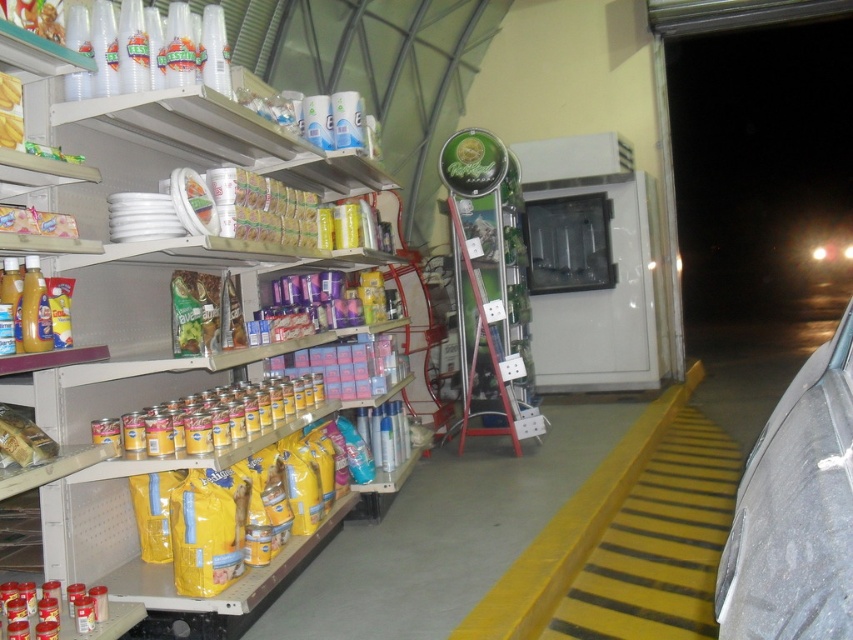
Question: Does yellow matte plastic bags at lower left have a lesser width compared to yellow rubber mat at lower right?

Choices:
 (A) yes
 (B) no

Answer: (A)

Question: Which object is farther from the camera taking this photo?

Choices:
 (A) yellow rubber mat at lower right
 (B) yellow matte plastic bags at lower left
 (C) matte gold foil at shelf left

Answer: (A)

Question: Which is nearer to the yellow rubber mat at lower right?

Choices:
 (A) matte gold foil at shelf left
 (B) yellow matte plastic bags at lower left

Answer: (B)

Question: Does yellow rubber mat at lower right have a larger size compared to matte gold foil at shelf left?

Choices:
 (A) yes
 (B) no

Answer: (A)

Question: Which point is farther to the camera?

Choices:
 (A) yellow matte plastic bags at lower left
 (B) matte gold foil at shelf left

Answer: (B)

Question: Does yellow matte plastic bags at lower left appear under yellow rubber mat at lower right?

Choices:
 (A) yes
 (B) no

Answer: (B)